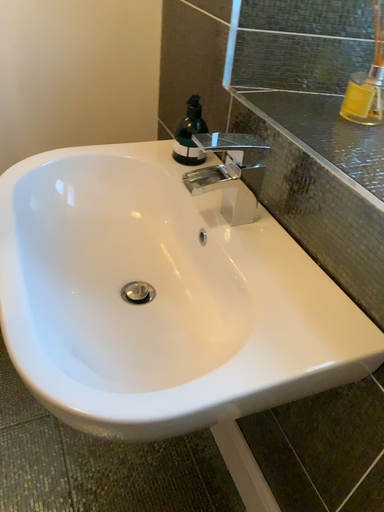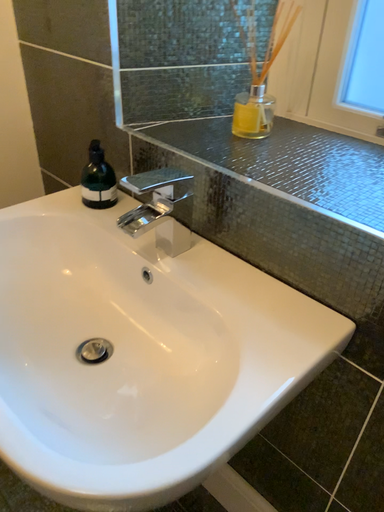
Question: Which way did the camera rotate in the video?

Choices:
 (A) rotated left
 (B) rotated right

Answer: (B)